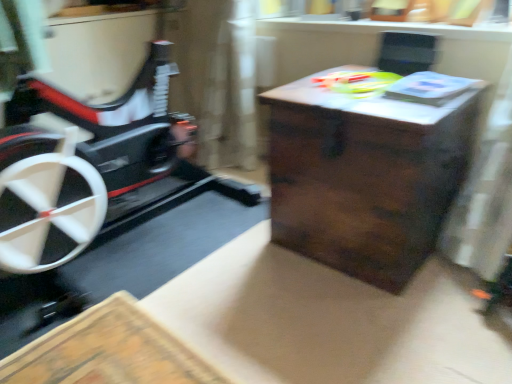
Describe the element at coordinates (357, 82) in the screenshot. I see `translucent plastic toy at upper center` at that location.

Find the location of a particular element. This screenshot has width=512, height=384. translucent plastic toy at upper center is located at coordinates (357, 82).

What is the approximate width of translucent plastic toy at upper center?

It is 16.82 inches.

This screenshot has width=512, height=384. What do you see at coordinates (365, 177) in the screenshot?
I see `dark wood table at center` at bounding box center [365, 177].

Where is `dark wood table at center`? The image size is (512, 384). dark wood table at center is located at coordinates (365, 177).

Measure the distance between dark wood table at center and camera.

A distance of 1.17 meters exists between dark wood table at center and camera.

Locate an element on the screen. translucent plastic toy at upper center is located at coordinates (357, 82).

Considering the positions of objects dark wood table at center and translucent plastic toy at upper center in the image provided, who is more to the right, dark wood table at center or translucent plastic toy at upper center?

dark wood table at center.

Between dark wood table at center and translucent plastic toy at upper center, which one is positioned in front?

dark wood table at center is closer to the camera.

Is point (279, 221) positioned before point (324, 84)?

No.

From the image's perspective, is dark wood table at center beneath translucent plastic toy at upper center?

Indeed, from the image's perspective, dark wood table at center is shown beneath translucent plastic toy at upper center.

From a real-world perspective, which object rests below the other?

dark wood table at center.

Considering the sizes of objects dark wood table at center and translucent plastic toy at upper center in the image provided, who is wider, dark wood table at center or translucent plastic toy at upper center?

Wider between the two is dark wood table at center.

Considering the relative sizes of dark wood table at center and translucent plastic toy at upper center in the image provided, is dark wood table at center shorter than translucent plastic toy at upper center?

In fact, dark wood table at center may be taller than translucent plastic toy at upper center.

Which of these two, dark wood table at center or translucent plastic toy at upper center, is smaller?

With smaller size is translucent plastic toy at upper center.

Does dark wood table at center contain translucent plastic toy at upper center?

No, translucent plastic toy at upper center is not a part of dark wood table at center.

From the picture: Does dark wood table at center touch translucent plastic toy at upper center?

No, dark wood table at center is not in contact with translucent plastic toy at upper center.

Is dark wood table at center looking in the opposite direction of translucent plastic toy at upper center?

No, dark wood table at center is not facing away from translucent plastic toy at upper center.

What's the angular difference between dark wood table at center and translucent plastic toy at upper center's facing directions?

1.47 degrees.

Measure the distance between dark wood table at center and translucent plastic toy at upper center.

dark wood table at center is 12.53 inches from translucent plastic toy at upper center.

Image resolution: width=512 pixels, height=384 pixels. What are the coordinates of `toy above the dark wood table at center (from the image's perspective)` in the screenshot? It's located at (357, 82).

Based on their positions, is translucent plastic toy at upper center located to the left or right of dark wood table at center?

From the image, it's evident that translucent plastic toy at upper center is to the left of dark wood table at center.

Which object is further away from the camera, translucent plastic toy at upper center or dark wood table at center?

Positioned behind is translucent plastic toy at upper center.

Is point (359, 73) farther from camera compared to point (326, 247)?

That is True.

From the image's perspective, is translucent plastic toy at upper center located above or below dark wood table at center?

translucent plastic toy at upper center is above dark wood table at center.

From a real-world perspective, is translucent plastic toy at upper center located beneath dark wood table at center?

Incorrect, from a real-world perspective, translucent plastic toy at upper center is higher than dark wood table at center.

Does translucent plastic toy at upper center have a greater width compared to dark wood table at center?

Incorrect, the width of translucent plastic toy at upper center does not surpass that of dark wood table at center.

Who is shorter, translucent plastic toy at upper center or dark wood table at center?

translucent plastic toy at upper center.

Does translucent plastic toy at upper center have a smaller size compared to dark wood table at center?

Yes, translucent plastic toy at upper center is smaller than dark wood table at center.

Is dark wood table at center inside translucent plastic toy at upper center?

That's incorrect, dark wood table at center is not inside translucent plastic toy at upper center.

Is translucent plastic toy at upper center directly adjacent to dark wood table at center?

No, translucent plastic toy at upper center is not touching dark wood table at center.

Is translucent plastic toy at upper center turned away from dark wood table at center?

translucent plastic toy at upper center is not turned away from dark wood table at center.

Can you tell me how much translucent plastic toy at upper center and dark wood table at center differ in facing direction?

They differ by 1.47 degrees in their facing directions.

How distant is translucent plastic toy at upper center from dark wood table at center?

They are 12.53 inches apart.

Identify the location of table that appears below the translucent plastic toy at upper center (from the image's perspective). (365, 177).

In order to click on toy above the dark wood table at center (from the image's perspective) in this screenshot , I will do 357,82.

This screenshot has width=512, height=384. Find the location of `table that is under the translucent plastic toy at upper center (from a real-world perspective)`. table that is under the translucent plastic toy at upper center (from a real-world perspective) is located at coordinates (365, 177).